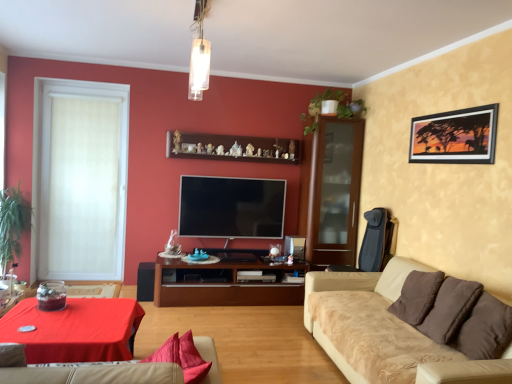
Locate an element on the screen. This screenshot has width=512, height=384. free point above silk matte painting at upper right (from a real-world perspective) is located at coordinates (445, 110).